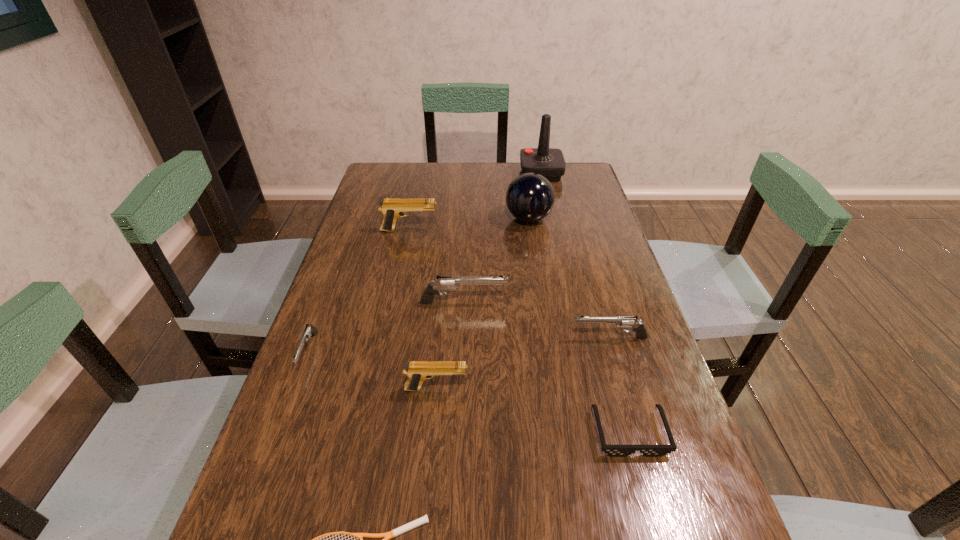
Locate an element on the screen. This screenshot has width=960, height=540. blank space located at the barrel of the tallest pistol is located at coordinates (501, 231).

Identify the location of vacant space located on the front-facing side of the biggest silver pistol. The width and height of the screenshot is (960, 540). (630, 302).

I want to click on blank space located 0.370m at the barrel of the smaller tan pistol, so click(640, 389).

Find the location of a particular element. free point located on the front-facing side of the rightmost silver pistol is located at coordinates (464, 338).

You are a GUI agent. You are given a task and a screenshot of the screen. Output one action in this format:
    pyautogui.click(x=<x>, y=<y>)
    Task: Click on the free space located 0.050m on the front-facing side of the rightmost silver pistol
    This screenshot has width=960, height=540.
    Given the screenshot: What is the action you would take?
    pyautogui.click(x=551, y=338)

Where is `vacant space located on the front-facing side of the rightmost silver pistol`? The image size is (960, 540). vacant space located on the front-facing side of the rightmost silver pistol is located at coordinates 451,338.

Identify the location of vacant point located 0.260m on the front-facing side of the seventh tallest object. (253, 497).

What are the coordinates of `vacant space positioned on the front-facing side of the sunglasses` in the screenshot? It's located at (643, 483).

Locate an element on the screen. The image size is (960, 540). object that is at the far edge is located at coordinates (549, 162).

This screenshot has height=540, width=960. Identify the location of joystick that is positioned at the right edge. (549, 162).